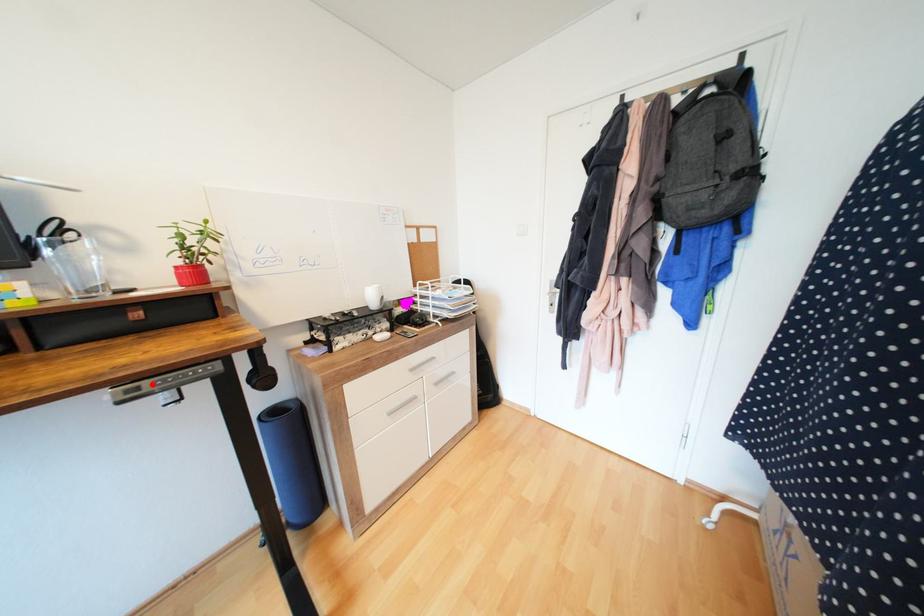
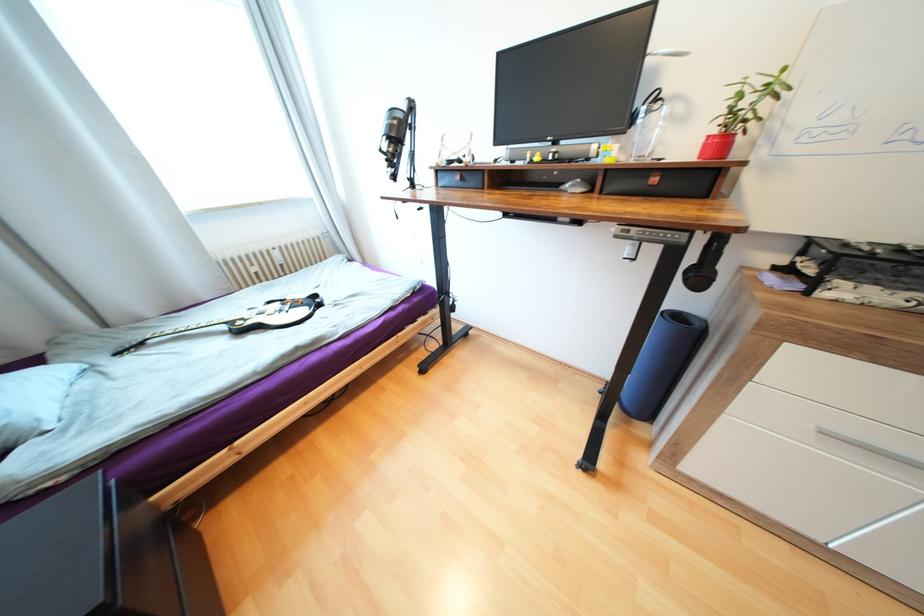
Locate, in the second image, the point that corresponds to the highlighted location in the first image.

(639, 230)